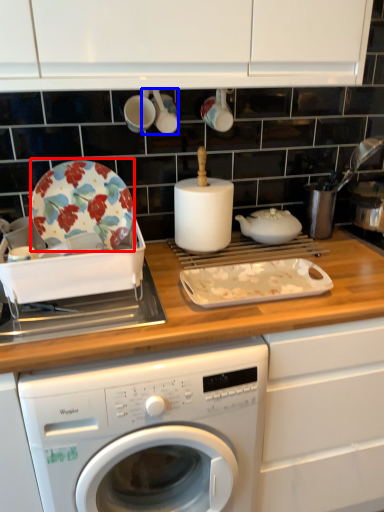
Question: Which object is further to the camera taking this photo, plate (highlighted by a red box) or tableware (highlighted by a blue box)?

Choices:
 (A) plate
 (B) tableware

Answer: (B)